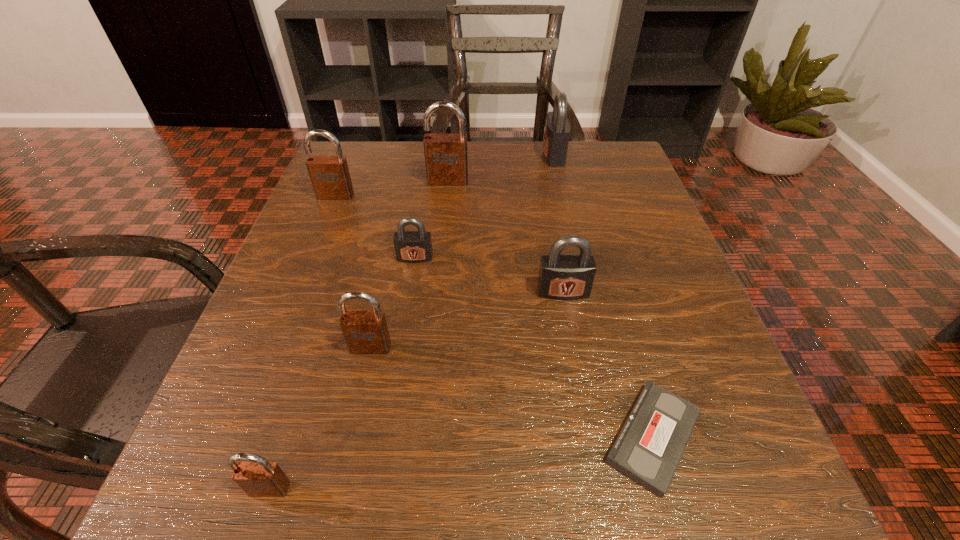
Where is `object that is at the far right corner`? This screenshot has height=540, width=960. object that is at the far right corner is located at coordinates (557, 131).

This screenshot has height=540, width=960. I want to click on object that is positioned at the near right corner, so click(x=650, y=445).

In the image, there is a desktop. Where is `free region at the far edge`? free region at the far edge is located at coordinates (494, 150).

You are a GUI agent. You are given a task and a screenshot of the screen. Output one action in this format:
    pyautogui.click(x=<x>, y=<y>)
    Task: Click on the vacant area at the near edge of the desktop
    The image size is (960, 540).
    Given the screenshot: What is the action you would take?
    pyautogui.click(x=451, y=458)

Image resolution: width=960 pixels, height=540 pixels. In order to click on free space at the left edge of the desktop in this screenshot , I will do `click(328, 210)`.

Where is `blank space at the right edge of the desktop`? The height and width of the screenshot is (540, 960). blank space at the right edge of the desktop is located at coordinates (607, 288).

Locate an element on the screen. The width and height of the screenshot is (960, 540). free space at the far left corner is located at coordinates (375, 190).

Identify the location of vacant position at the far right corner of the desktop. tap(636, 191).

Find the location of a particular element. The image size is (960, 540). vacant region between the second nearest gray padlock and the farthest gray padlock is located at coordinates (485, 206).

Find the location of a particular element. blank region between the third nearest object and the farthest object is located at coordinates (462, 251).